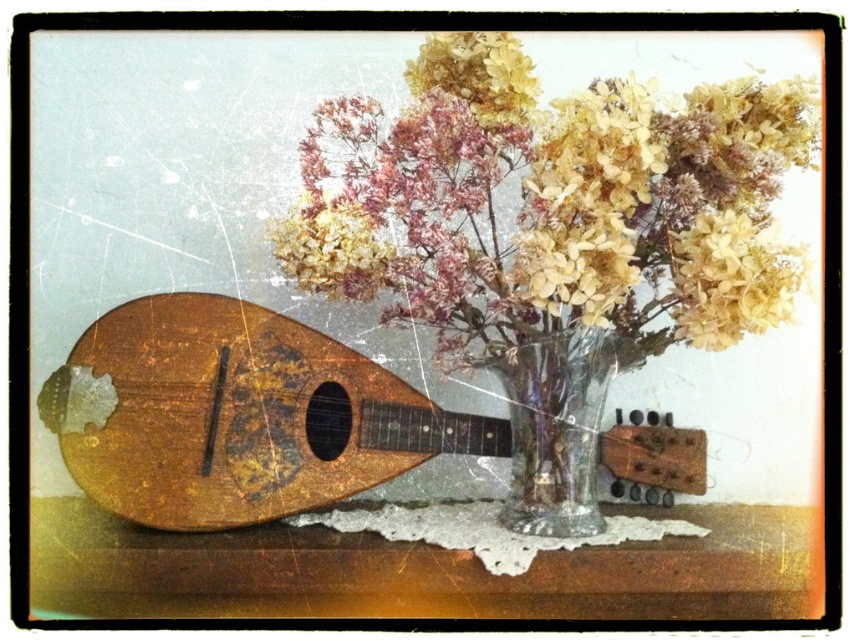
Question: Does translucent glass vase at center have a smaller size compared to wooden mandolin at left?

Choices:
 (A) yes
 (B) no

Answer: (B)

Question: Does wooden mandolin at left appear over transparent glass vase at center?

Choices:
 (A) no
 (B) yes

Answer: (A)

Question: Which point is closer to the camera?

Choices:
 (A) wooden mandolin at left
 (B) transparent glass vase at center

Answer: (A)

Question: Which point is farther from the camera taking this photo?

Choices:
 (A) (544, 413)
 (B) (617, 289)
 (C) (651, 460)

Answer: (C)

Question: Among these points, which one is nearest to the camera?

Choices:
 (A) (544, 486)
 (B) (577, 186)

Answer: (B)

Question: Can you confirm if wooden mandolin at left is positioned above transparent glass vase at center?

Choices:
 (A) no
 (B) yes

Answer: (A)